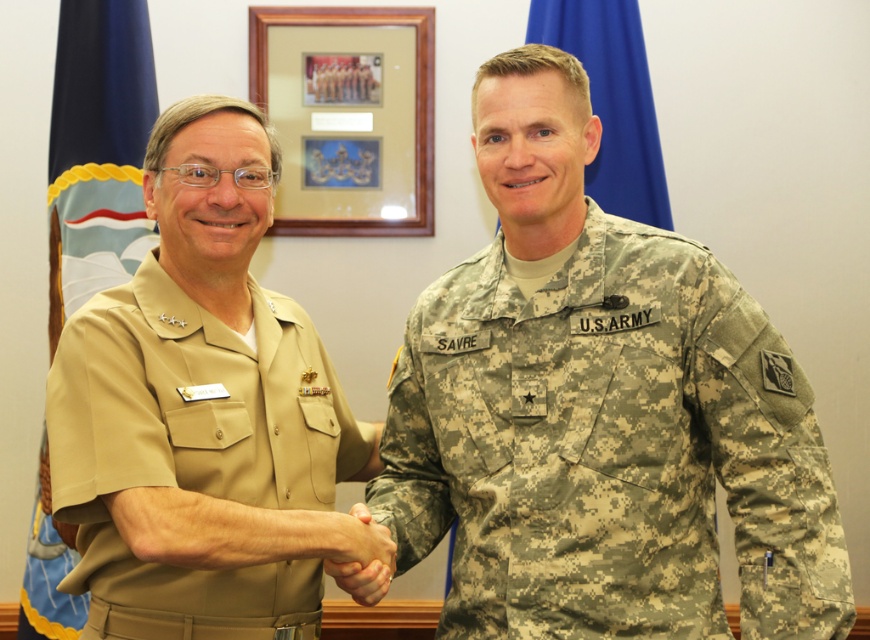
Based on the scene description, where is the camouflage fabric us army uniform at center located in the image?

The camouflage fabric us army uniform at center is located at the point [609,449] in the image.

You are a tailor who needs to determine which uniform requires more fabric to make between the camouflage fabric us army uniform at center and the tan fabric uniform at left. Based on the image, which one would need more fabric?

The camouflage fabric us army uniform at center requires more fabric because it is larger in size than the tan fabric uniform at left.